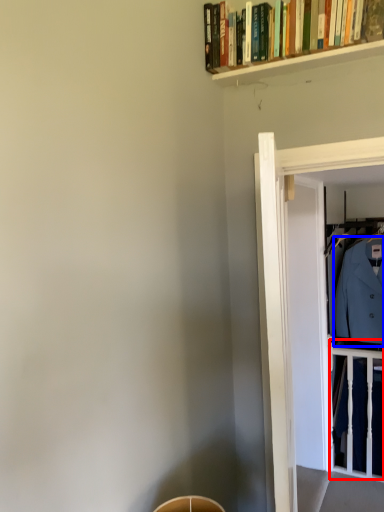
Question: Which point is closer to the camera, balustrade (highlighted by a red box) or dress shirt (highlighted by a blue box)?

Choices:
 (A) balustrade
 (B) dress shirt

Answer: (B)